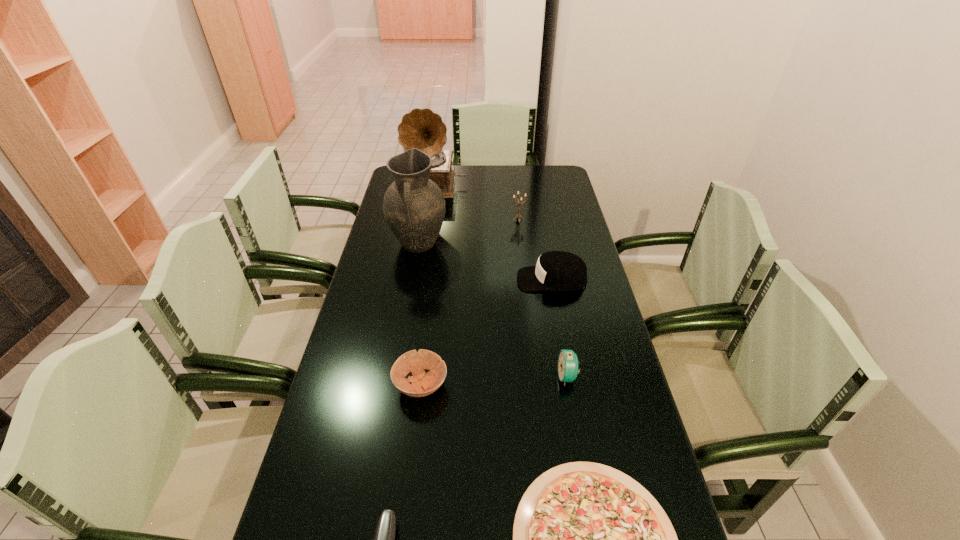
Locate an element on the screen. The image size is (960, 540). record player is located at coordinates (422, 129).

Where is `the sixth nearest object`? the sixth nearest object is located at coordinates (414, 207).

Find the location of a particular element. The height and width of the screenshot is (540, 960). the seventh nearest object is located at coordinates (518, 215).

Where is `the third tallest object`? Image resolution: width=960 pixels, height=540 pixels. the third tallest object is located at coordinates (518, 215).

Image resolution: width=960 pixels, height=540 pixels. Find the location of `cap`. cap is located at coordinates (555, 270).

Identify the location of alarm clock. (568, 362).

Where is `bowl`? The width and height of the screenshot is (960, 540). bowl is located at coordinates (422, 384).

I want to click on free space located from the horn of the farthest object, so click(429, 222).

You are a GUI agent. You are given a task and a screenshot of the screen. Output one action in this format:
    pyautogui.click(x=<x>, y=<y>)
    Task: Click on the vacant space situated on the side of the sixth nearest object with the handle
    
    Given the screenshot: What is the action you would take?
    pyautogui.click(x=408, y=303)

At what (x,y) coordinates should I click in order to perform the action: click on free spot located 0.290m on the back of the second farthest object. Please return your answer as a coordinate pair (x, y). This screenshot has width=960, height=540. Looking at the image, I should click on (514, 180).